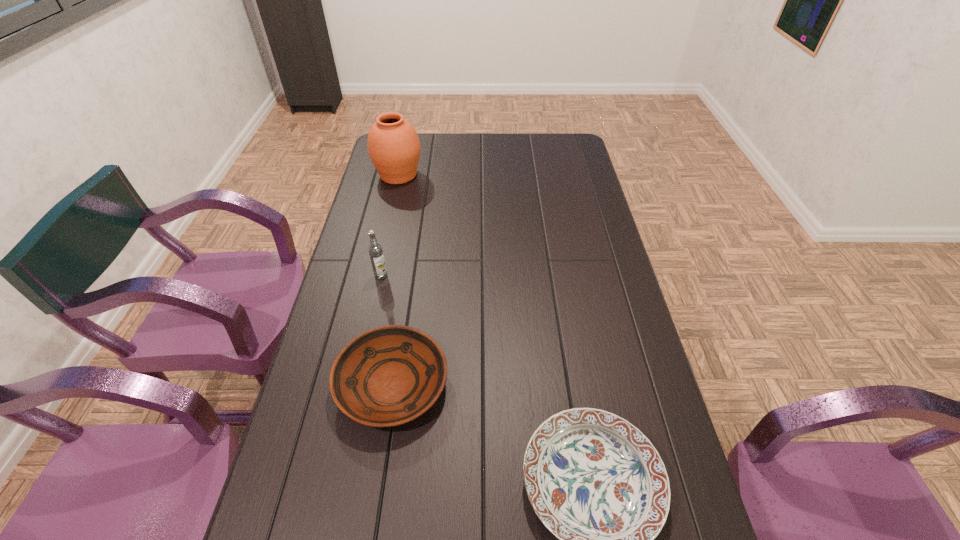
Locate an element on the screen. Image resolution: width=960 pixels, height=540 pixels. urn located in the left edge section of the desktop is located at coordinates (x=393, y=145).

Locate an element on the screen. vodka located at the left edge is located at coordinates point(375,250).

You are a GUI agent. You are given a task and a screenshot of the screen. Output one action in this format:
    pyautogui.click(x=<x>, y=<y>)
    Task: Click on the plate at the left edge
    The height and width of the screenshot is (540, 960).
    Given the screenshot: What is the action you would take?
    pyautogui.click(x=387, y=376)

Where is `object located in the far left corner section of the desktop`? The image size is (960, 540). object located in the far left corner section of the desktop is located at coordinates (393, 145).

You are a GUI agent. You are given a task and a screenshot of the screen. Output one action in this format:
    pyautogui.click(x=<x>, y=<y>)
    Task: Click on the free space at the far edge of the desktop
    The image size is (960, 540).
    Given the screenshot: What is the action you would take?
    pyautogui.click(x=517, y=145)

The image size is (960, 540). Find the location of `free point at the left edge`. free point at the left edge is located at coordinates (377, 309).

Where is `free point at the right edge`? The image size is (960, 540). free point at the right edge is located at coordinates (560, 210).

This screenshot has width=960, height=540. What are the coordinates of `vacant space at the far right corner of the desktop` in the screenshot? It's located at (581, 147).

Locate an element on the screen. object that is the closest to the second shortest object is located at coordinates (596, 482).

Locate which object is the closest to the rightmost object. Please provide its 2D coordinates. Your answer should be formatted as a tuple, i.e. [(x, y)], where the tuple contains the x and y coordinates of a point satisfying the conditions above.

[(387, 376)]